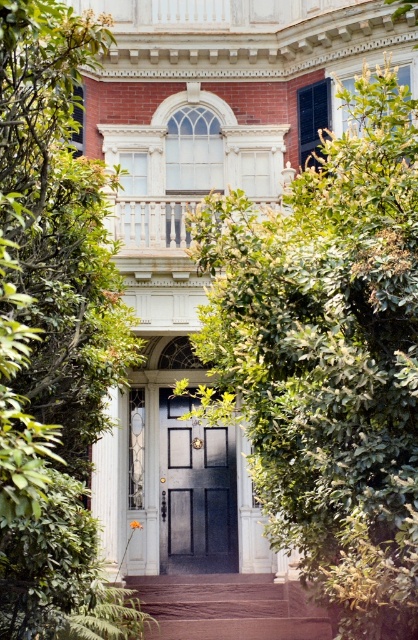
Question: Does green leafy bush at center have a greater width compared to matte black door at center?

Choices:
 (A) no
 (B) yes

Answer: (B)

Question: Does green leafy bush at center have a greater width compared to brown stone stairs at center?

Choices:
 (A) no
 (B) yes

Answer: (A)

Question: Which object appears farthest from the camera in this image?

Choices:
 (A) green leafy bush at center
 (B) brown stone stairs at center

Answer: (B)

Question: Is green leafy bush at center in front of brown stone stairs at center?

Choices:
 (A) yes
 (B) no

Answer: (A)

Question: Which point is closer to the camera taking this photo?

Choices:
 (A) (303, 449)
 (B) (323, 636)

Answer: (A)

Question: Which point is closer to the camera taking this photo?

Choices:
 (A) (209, 484)
 (B) (236, 596)

Answer: (B)